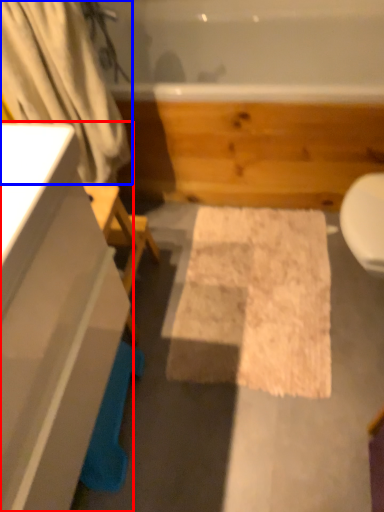
Question: Which of the following is the farthest to the observer, bathroom cabinet (highlighted by a red box) or shower curtain (highlighted by a blue box)?

Choices:
 (A) bathroom cabinet
 (B) shower curtain

Answer: (B)